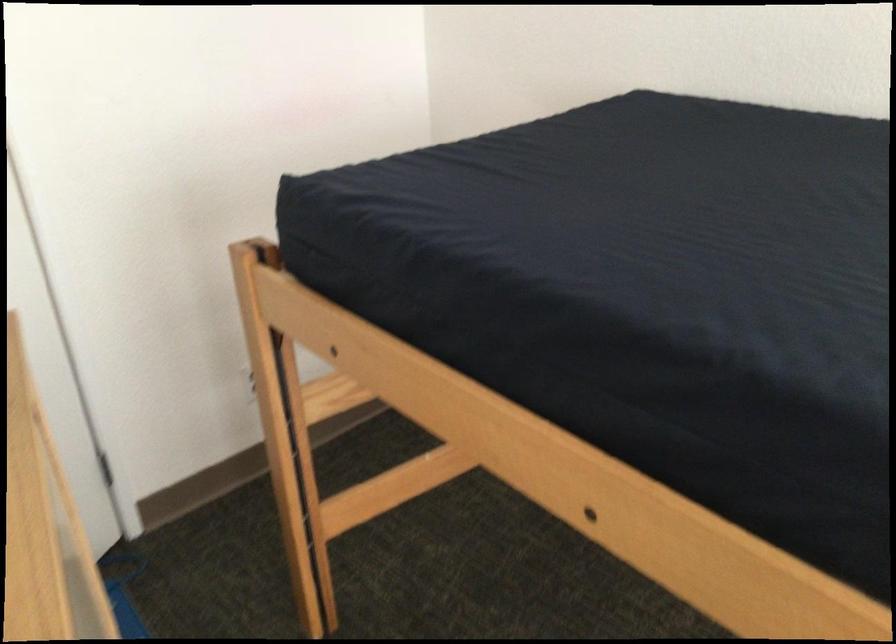
The width and height of the screenshot is (896, 644). What are the coordinates of `wooden bed frame rail` in the screenshot? It's located at (262, 251).